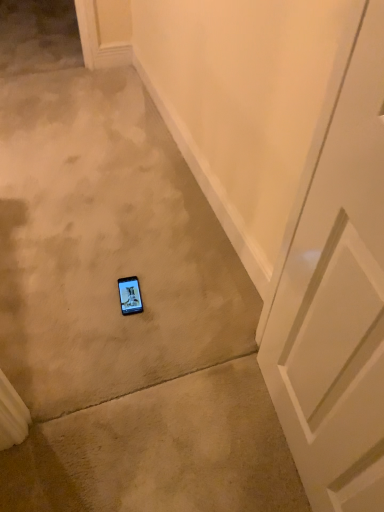
Image resolution: width=384 pixels, height=512 pixels. Describe the element at coordinates (337, 300) in the screenshot. I see `white matte door at right` at that location.

Measure the distance between white matte door at right and camera.

21.97 inches.

What is the approximate height of white matte door at right?

It is 3.60 feet.

Identify the location of white matte door at right. This screenshot has width=384, height=512. (337, 300).

Where is `white matte door at right`? The width and height of the screenshot is (384, 512). white matte door at right is located at coordinates pyautogui.click(x=337, y=300).